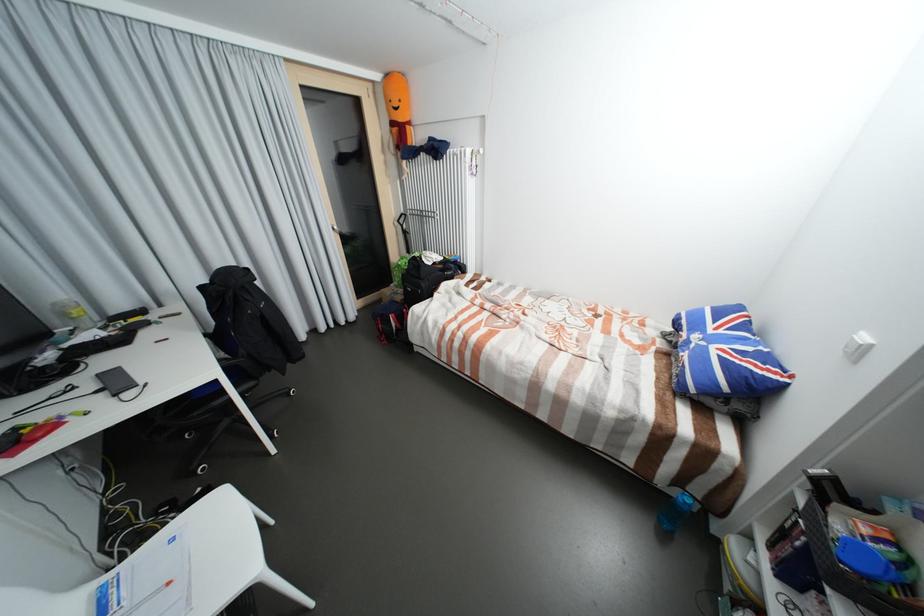
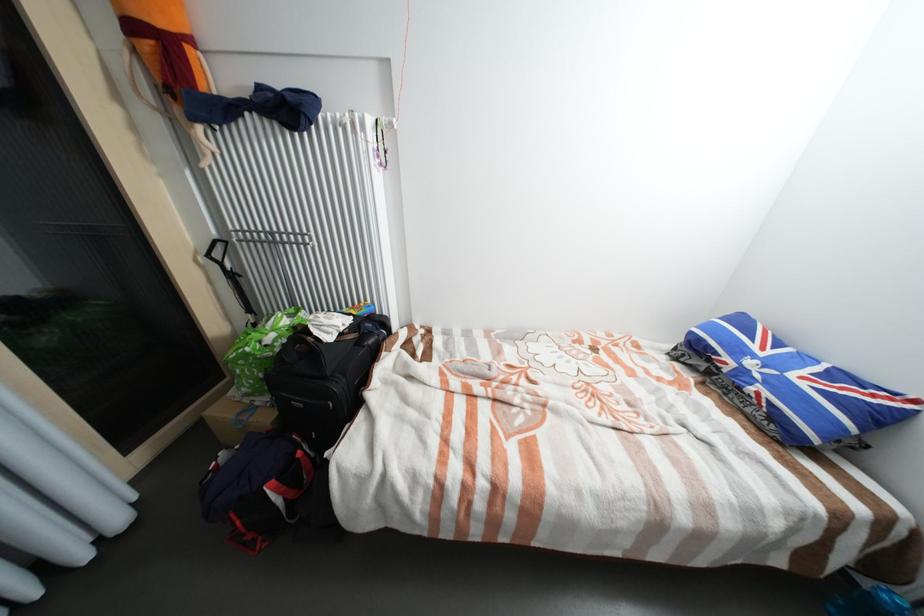
Where in the second image is the point corresponding to (x=407, y=299) from the first image?

(273, 419)